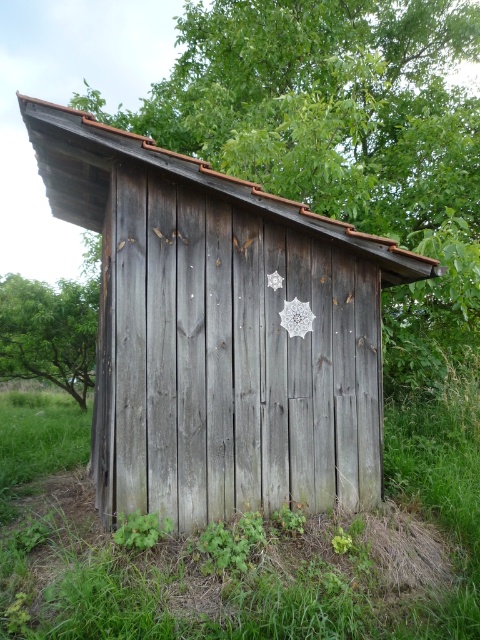
Between point (370, 52) and point (146, 515), which one is positioned behind?

The point (370, 52) is behind.

Who is taller, green wood at center or green matte leaf at lower left?

With more height is green wood at center.

Image resolution: width=480 pixels, height=640 pixels. Describe the element at coordinates (343, 136) in the screenshot. I see `green wood at center` at that location.

Locate an element on the screen. This screenshot has width=480, height=640. green wood at center is located at coordinates (343, 136).

Between green grass at lower center and green matte leaf at lower left, which one is positioned lower?

green grass at lower center is below.

Can you confirm if green grass at lower center is thinner than green matte leaf at lower left?

Incorrect, green grass at lower center's width is not less than green matte leaf at lower left's.

Is point (314, 536) closer to camera compared to point (152, 531)?

No, (314, 536) is behind (152, 531).

The image size is (480, 640). In order to click on green grass at lower center in this screenshot , I will do `click(263, 552)`.

Based on the photo, does weathered wood barn at center have a lesser width compared to green grass at lower center?

In fact, weathered wood barn at center might be wider than green grass at lower center.

Is weathered wood barn at center to the right of green grass at lower center from the viewer's perspective?

Indeed, weathered wood barn at center is positioned on the right side of green grass at lower center.

Which is in front, point (112, 440) or point (458, 512)?

Point (112, 440) is in front.

The image size is (480, 640). Identify the location of weathered wood barn at center. (220, 330).